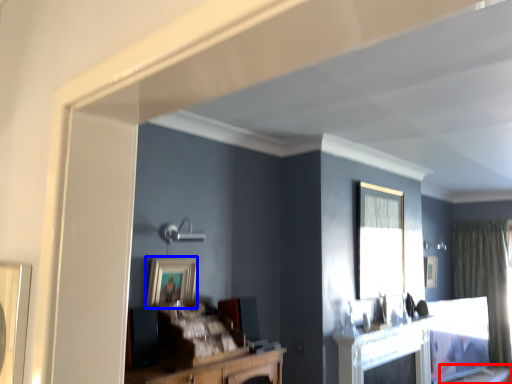
Question: Which object is further to the camera taking this photo, table (highlighted by a red box) or picture frame (highlighted by a blue box)?

Choices:
 (A) table
 (B) picture frame

Answer: (A)